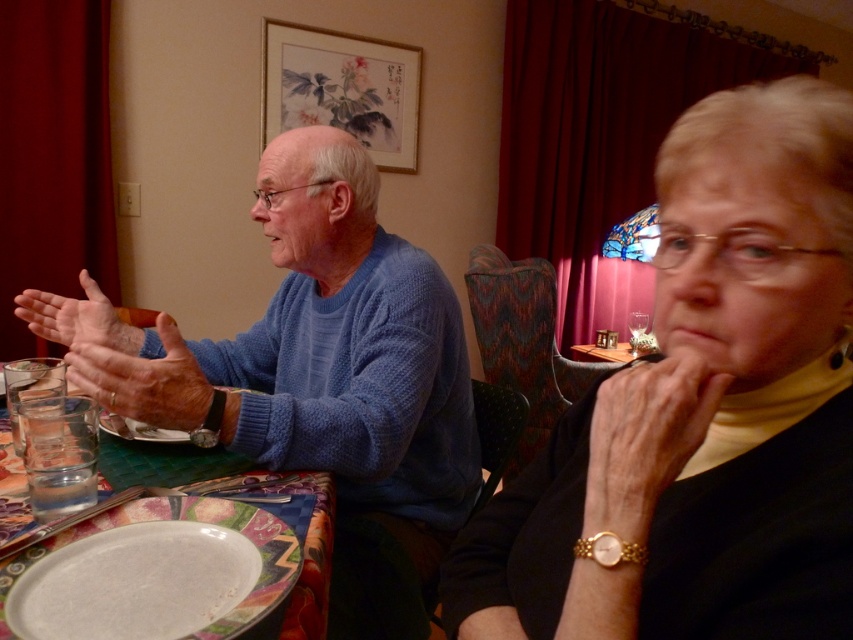
Question: From the image, what is the correct spatial relationship of matte ceramic plate at center in relation to matte blue sweater at left?

Choices:
 (A) left
 (B) right

Answer: (B)

Question: Which point is closer to the camera?

Choices:
 (A) (772, 136)
 (B) (381, 371)
 (C) (625, 432)

Answer: (A)

Question: Does matte black sweater at center lie behind matte blue sweater at left?

Choices:
 (A) no
 (B) yes

Answer: (A)

Question: Which object appears farthest from the camera in this image?

Choices:
 (A) smooth skin hand at lower right
 (B) matte ceramic plate at center

Answer: (B)

Question: Which object is closer to the camera taking this photo?

Choices:
 (A) white glossy plate at lower left
 (B) matte blue sweater at left
 (C) matte black sweater at center
 (D) smooth skin hand at lower right

Answer: (C)

Question: Does white glossy plate at lower left appear on the left side of matte ceramic plate at center?

Choices:
 (A) yes
 (B) no

Answer: (B)